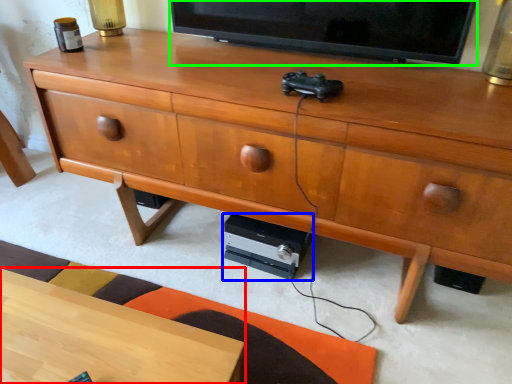
Question: Estimate the real-world distances between objects in this image. Which object is closer to desk (highlighted by a red box), stereo (highlighted by a blue box) or television (highlighted by a green box)?

Choices:
 (A) stereo
 (B) television

Answer: (A)